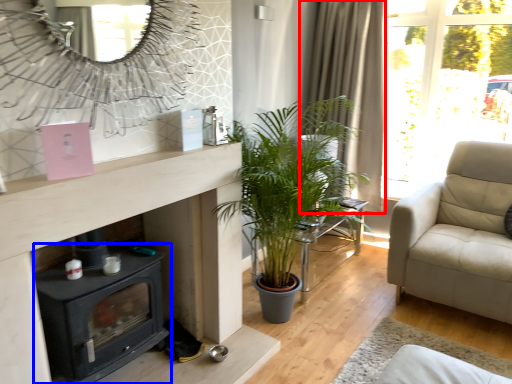
Question: Which object is further to the camera taking this photo, curtain (highlighted by a red box) or wood burning stove (highlighted by a blue box)?

Choices:
 (A) curtain
 (B) wood burning stove

Answer: (A)